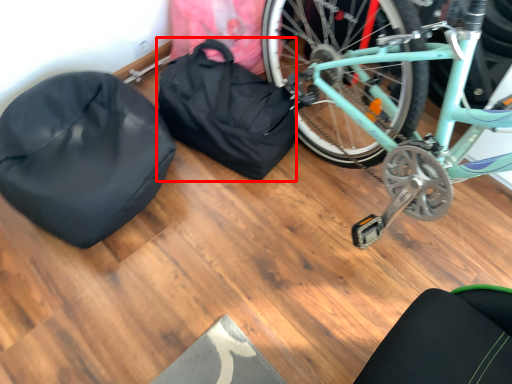
Question: Considering the relative positions of bag (annotated by the red box) and sleeping bag in the image provided, where is bag (annotated by the red box) located with respect to the staircase?

Choices:
 (A) right
 (B) left

Answer: (A)